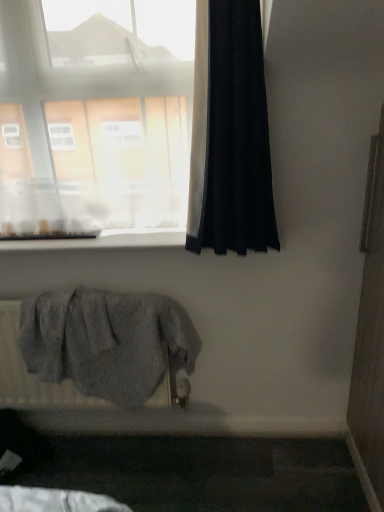
The height and width of the screenshot is (512, 384). What do you see at coordinates (103, 241) in the screenshot?
I see `white smooth window sill at upper center` at bounding box center [103, 241].

In order to face transparent glass window at upper left, should I rotate leftwards or rightwards?

To align with it, rotate left about 14.626°.

I want to click on white smooth window sill at upper center, so click(x=103, y=241).

Would you say transparent glass window at upper left is a long distance from black fabric curtain at right?

No, transparent glass window at upper left is not far from black fabric curtain at right.

Which object is closer to the camera taking this photo, transparent glass window at upper left or black fabric curtain at right?

black fabric curtain at right is closer to the camera.

Does transparent glass window at upper left have a smaller size compared to black fabric curtain at right?

No.

This screenshot has width=384, height=512. Identify the location of window lying on the left of gray fabric radiator at lower left. (96, 118).

Is gray fabric radiator at lower left positioned far away from transparent glass window at upper left?

gray fabric radiator at lower left is actually quite close to transparent glass window at upper left.

From a real-world perspective, relative to transparent glass window at upper left, is gray fabric radiator at lower left vertically above or below?

gray fabric radiator at lower left is below transparent glass window at upper left.

Relative to transparent glass window at upper left, is gray fabric radiator at lower left in front or behind?

gray fabric radiator at lower left is behind transparent glass window at upper left.

Identify the location of window sill behind the transparent glass window at upper left. (103, 241).

Which object is more forward, transparent glass window at upper left or white smooth window sill at upper center?

transparent glass window at upper left is closer to the camera.

Measure the distance from transparent glass window at upper left to white smooth window sill at upper center.

transparent glass window at upper left is 35.36 centimeters from white smooth window sill at upper center.

Is transparent glass window at upper left not within white smooth window sill at upper center?

transparent glass window at upper left is positioned outside white smooth window sill at upper center.

Is black fabric curtain at right to the left of gray fabric radiator at lower left from the viewer's perspective?

No, black fabric curtain at right is not to the left of gray fabric radiator at lower left.

Is black fabric curtain at right positioned before gray fabric radiator at lower left?

Yes, the depth of black fabric curtain at right is less than that of gray fabric radiator at lower left.

Could you tell me if black fabric curtain at right is facing gray fabric radiator at lower left?

No, black fabric curtain at right is not facing towards gray fabric radiator at lower left.

In the scene shown: Is black fabric curtain at right situated inside gray fabric radiator at lower left or outside?

black fabric curtain at right lies outside gray fabric radiator at lower left.

Choose the correct answer: Is black fabric curtain at right inside transparent glass window at upper left or outside it?

black fabric curtain at right is not enclosed by transparent glass window at upper left.

From a real-world perspective, is black fabric curtain at right on top of transparent glass window at upper left?

No, from a real-world perspective, black fabric curtain at right is not above transparent glass window at upper left.

Between point (234, 66) and point (4, 181), which one is positioned behind?

The point (4, 181) is behind.

Considering the sizes of black fabric curtain at right and white smooth window sill at upper center in the image, is black fabric curtain at right taller or shorter than white smooth window sill at upper center?

Considering their sizes, black fabric curtain at right has more height than white smooth window sill at upper center.

From the image's perspective, which is below, black fabric curtain at right or white smooth window sill at upper center?

From the image's view, white smooth window sill at upper center is below.

From a real-world perspective, relative to white smooth window sill at upper center, is black fabric curtain at right vertically above or below?

black fabric curtain at right is above white smooth window sill at upper center.

What's the angular difference between black fabric curtain at right and white smooth window sill at upper center's facing directions?

There is a 0.0014-degree angle between the facing directions of black fabric curtain at right and white smooth window sill at upper center.

Looking at this image, considering the relative positions of transparent glass window at upper left and gray fabric radiator at lower left in the image provided, is transparent glass window at upper left to the right of gray fabric radiator at lower left from the viewer's perspective?

No, transparent glass window at upper left is not to the right of gray fabric radiator at lower left.

In the scene shown: Is transparent glass window at upper left turned away from gray fabric radiator at lower left?

No, gray fabric radiator at lower left is not at the back of transparent glass window at upper left.

Is transparent glass window at upper left positioned far away from gray fabric radiator at lower left?

No, transparent glass window at upper left is not far from gray fabric radiator at lower left.

Locate an element on the screen. The height and width of the screenshot is (512, 384). window on the left of black fabric curtain at right is located at coordinates (96, 118).

Where is `radiator located underneath the transparent glass window at upper left (from a real-world perspective)`? This screenshot has height=512, width=384. radiator located underneath the transparent glass window at upper left (from a real-world perspective) is located at coordinates (30, 375).

Considering their positions, is transparent glass window at upper left positioned closer to white smooth window sill at upper center than black fabric curtain at right?

transparent glass window at upper left is positioned closer to the anchor white smooth window sill at upper center.

Looking at the image, which one is located closer to white smooth window sill at upper center, black fabric curtain at right or transparent glass window at upper left?

Among the two, transparent glass window at upper left is located nearer to white smooth window sill at upper center.

Which object lies nearer to the anchor point white smooth window sill at upper center, transparent glass window at upper left or gray fabric radiator at lower left?

The object closer to white smooth window sill at upper center is transparent glass window at upper left.

Considering their positions, is black fabric curtain at right positioned further to transparent glass window at upper left than white smooth window sill at upper center?

The object further to transparent glass window at upper left is white smooth window sill at upper center.

Based on their spatial positions, is transparent glass window at upper left or gray fabric radiator at lower left closer to black fabric curtain at right?

Based on the image, transparent glass window at upper left appears to be nearer to black fabric curtain at right.

From the image, which object appears to be farther from black fabric curtain at right, white smooth window sill at upper center or gray fabric radiator at lower left?

Based on the image, gray fabric radiator at lower left appears to be further to black fabric curtain at right.

From the image, which object appears to be nearer to gray fabric radiator at lower left, white smooth window sill at upper center or transparent glass window at upper left?

white smooth window sill at upper center is closer to gray fabric radiator at lower left.

Which object lies nearer to the anchor point black fabric curtain at right, transparent glass window at upper left or white smooth window sill at upper center?

The object closer to black fabric curtain at right is transparent glass window at upper left.

The width and height of the screenshot is (384, 512). What are the coordinates of `window sill located between transparent glass window at upper left and black fabric curtain at right in the left-right direction` in the screenshot? It's located at (103, 241).

Locate an element on the screen. The height and width of the screenshot is (512, 384). window sill between transparent glass window at upper left and gray fabric radiator at lower left vertically is located at coordinates point(103,241).

I want to click on curtain between transparent glass window at upper left and gray fabric radiator at lower left in the up-down direction, so click(230, 133).

Image resolution: width=384 pixels, height=512 pixels. I want to click on window sill between black fabric curtain at right and gray fabric radiator at lower left in the up-down direction, so click(x=103, y=241).